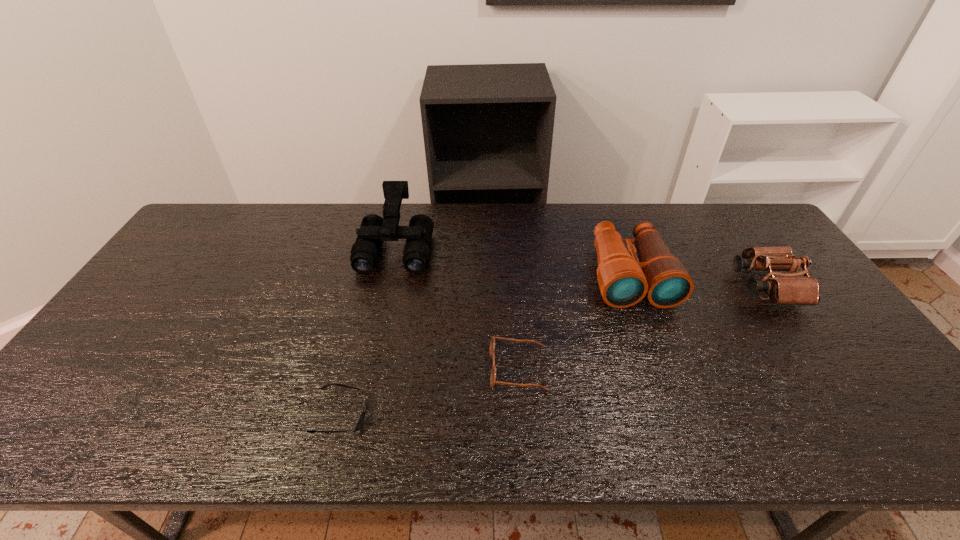
This screenshot has width=960, height=540. I want to click on free space that satisfies the following two spatial constraints: 1. through the lenses of the second binoculars from right to left; 2. on the lenses of the shortest object, so click(681, 415).

You are a GUI agent. You are given a task and a screenshot of the screen. Output one action in this format:
    pyautogui.click(x=<x>, y=<y>)
    Task: Click on the free space that satisfies the following two spatial constraints: 1. on the front lenses of the tallest binoculars; 2. on the lenses of the shortest object
    
    Given the screenshot: What is the action you would take?
    pyautogui.click(x=360, y=415)